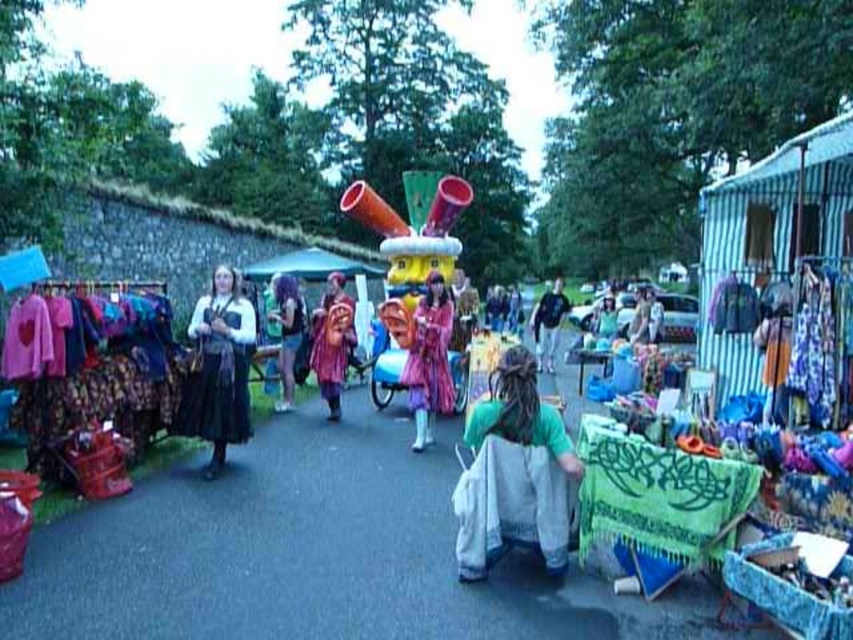
Question: Where is green cotton shirt at center located in relation to matte black dress at left in the image?

Choices:
 (A) below
 (B) above

Answer: (A)

Question: Can you confirm if green cotton shirt at center is bigger than shiny purple dress at center?

Choices:
 (A) yes
 (B) no

Answer: (B)

Question: Which point is farther to the camera?

Choices:
 (A) (323, 330)
 (B) (283, 337)
 (C) (283, 410)
 (D) (467, 520)

Answer: (C)

Question: Estimate the real-world distances between objects in this image. Which object is farther from the matte black dress at left?

Choices:
 (A) purple fabric dress at center
 (B) blue fabric dress at center
 (C) matte black dress at center
 (D) shiny metallic helmet at center

Answer: (B)

Question: Is green cotton shirt at center closer to camera compared to matte black dress at left?

Choices:
 (A) no
 (B) yes

Answer: (B)

Question: Which object is farther from the camera taking this photo?

Choices:
 (A) matte black dress at center
 (B) blue fabric dress at center

Answer: (B)